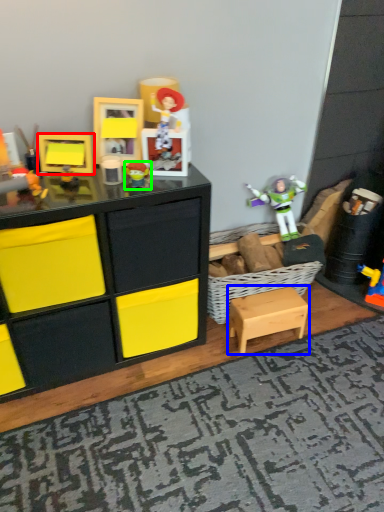
Question: Based on their relative distances, which object is farther from toy (highlighted by a red box)? Choose from table (highlighted by a blue box) and toy (highlighted by a green box).

Choices:
 (A) table
 (B) toy

Answer: (A)